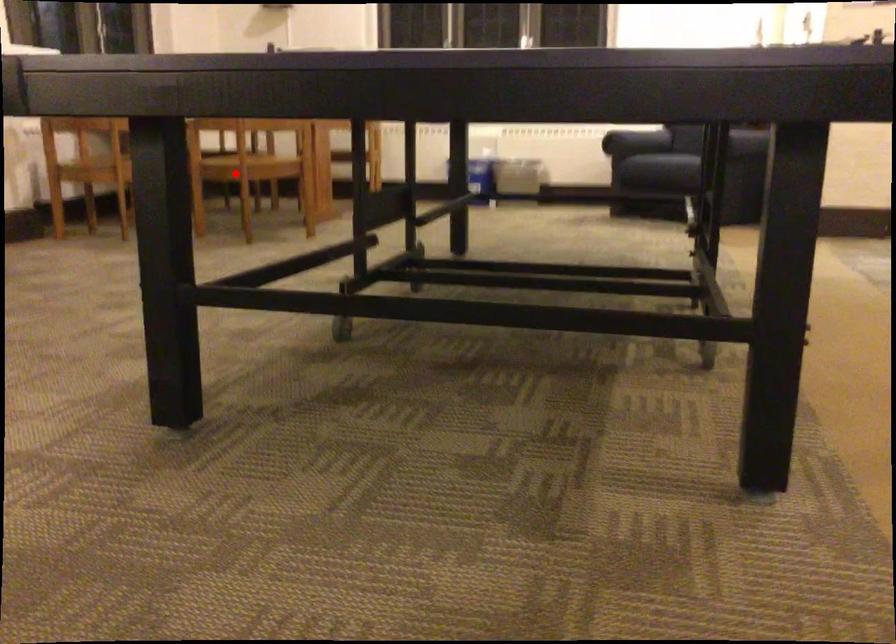
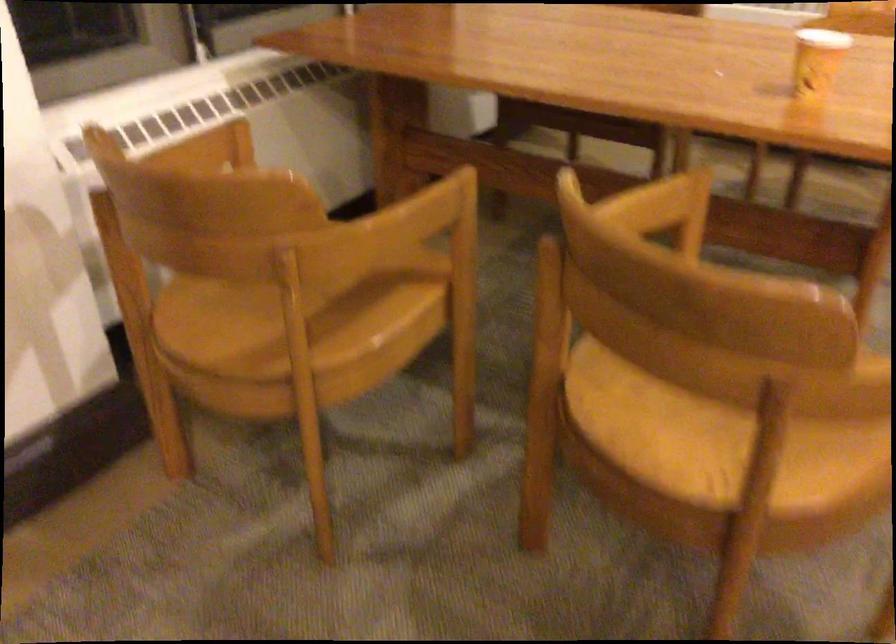
Question: I am providing you with two images of the same scene from different viewpoints. Given a red point in image1, look at the same physical point in image2. Is it:

Choices:
 (A) Closer to the viewpoint
 (B) Farther from the viewpoint

Answer: (A)